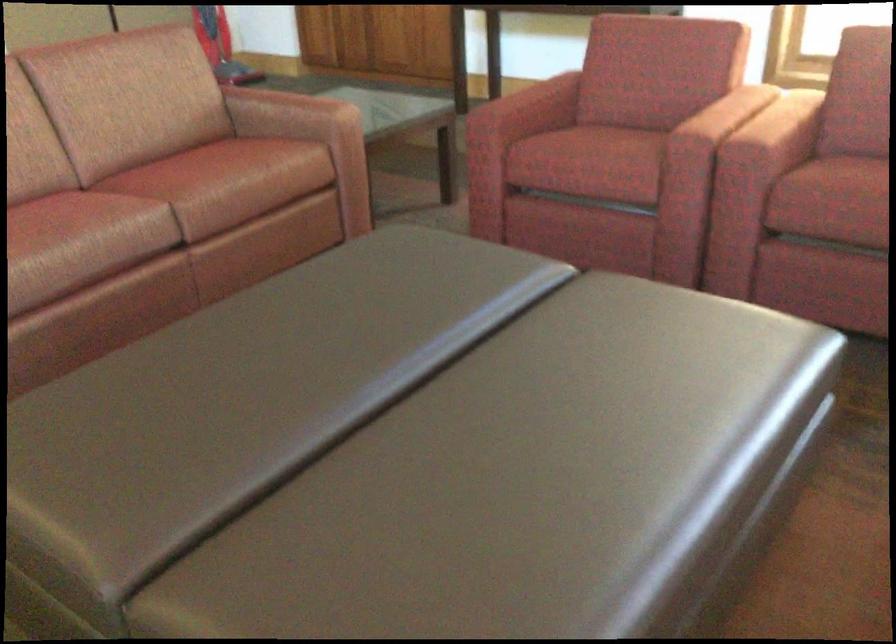
Question: How did the camera likely rotate?

Choices:
 (A) Left
 (B) Right
 (C) Up
 (D) Down

Answer: (B)